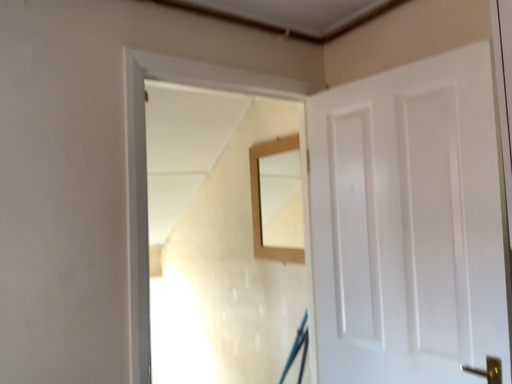
Question: From the image's perspective, is wooden mirror at center over wooden frame at center?

Choices:
 (A) no
 (B) yes

Answer: (B)

Question: Is wooden mirror at center wider than wooden frame at center?

Choices:
 (A) no
 (B) yes

Answer: (A)

Question: Could you tell me if wooden mirror at center is turned towards wooden frame at center?

Choices:
 (A) no
 (B) yes

Answer: (B)

Question: From a real-world perspective, does wooden mirror at center stand above wooden frame at center?

Choices:
 (A) yes
 (B) no

Answer: (A)

Question: Does wooden mirror at center appear on the right side of wooden frame at center?

Choices:
 (A) no
 (B) yes

Answer: (B)

Question: Is wooden mirror at center in contact with wooden frame at center?

Choices:
 (A) yes
 (B) no

Answer: (B)

Question: Considering the relative sizes of wooden frame at center and wooden mirror at center in the image provided, is wooden frame at center shorter than wooden mirror at center?

Choices:
 (A) no
 (B) yes

Answer: (A)

Question: Is wooden frame at center placed right next to wooden mirror at center?

Choices:
 (A) yes
 (B) no

Answer: (B)

Question: From the image's perspective, is wooden frame at center below wooden mirror at center?

Choices:
 (A) no
 (B) yes

Answer: (B)

Question: Is wooden frame at center positioned far away from wooden mirror at center?

Choices:
 (A) yes
 (B) no

Answer: (B)

Question: From the image's perspective, is wooden frame at center on wooden mirror at center?

Choices:
 (A) yes
 (B) no

Answer: (B)

Question: Considering the relative sizes of wooden frame at center and wooden mirror at center in the image provided, is wooden frame at center thinner than wooden mirror at center?

Choices:
 (A) no
 (B) yes

Answer: (A)

Question: Is wooden frame at center surrounding white glossy door at right?

Choices:
 (A) yes
 (B) no

Answer: (B)